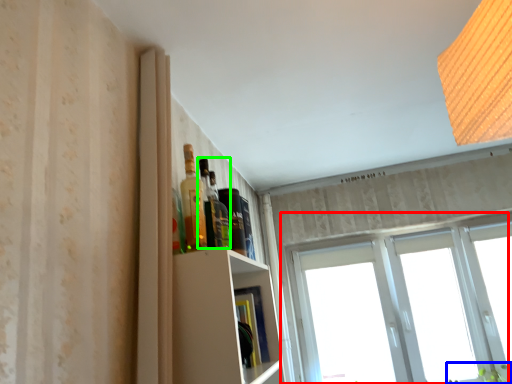
Question: Considering the real-world distances, which object is farthest from window (highlighted by a red box)? plant (highlighted by a blue box) or bottle (highlighted by a green box)?

Choices:
 (A) plant
 (B) bottle

Answer: (B)